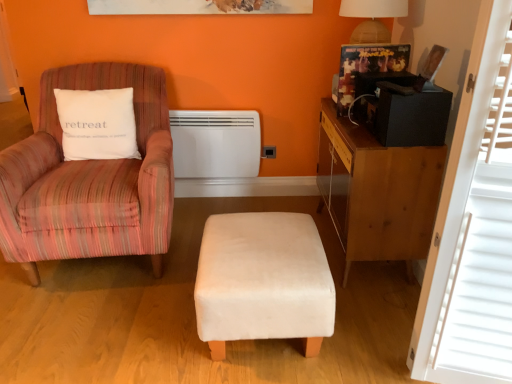
Describe the element at coordinates (215, 143) in the screenshot. I see `white matte heater at center` at that location.

Describe the element at coordinates (89, 179) in the screenshot. The width and height of the screenshot is (512, 384). I see `pink striped fabric chair at left` at that location.

The height and width of the screenshot is (384, 512). What do you see at coordinates (263, 281) in the screenshot? I see `velvet white stool at center` at bounding box center [263, 281].

This screenshot has height=384, width=512. I want to click on white matte heater at center, so click(215, 143).

From a real-world perspective, is white wood window screen at right located higher than white matte heater at center?

Correct, in the physical world, white wood window screen at right is higher than white matte heater at center.

Is white wood window screen at right aimed at white matte heater at center?

No, white wood window screen at right does not turn towards white matte heater at center.

Between point (509, 86) and point (179, 130), which one is positioned in front?

The point (509, 86) is closer.

From a real-world perspective, relative to white wood window screen at right, is pink striped fabric chair at left vertically above or below?

pink striped fabric chair at left is below white wood window screen at right.

From the image's perspective, which is above, pink striped fabric chair at left or white wood window screen at right?

pink striped fabric chair at left appears higher in the image.

Locate an element on the screen. The image size is (512, 384). chair on the left of white wood window screen at right is located at coordinates (89, 179).

Is pink striped fabric chair at left in front of or behind white wood window screen at right in the image?

pink striped fabric chair at left is positioned farther from the viewer than white wood window screen at right.

Looking at this image, considering the relative sizes of white wood window screen at right and wooden desk at right in the image provided, is white wood window screen at right smaller than wooden desk at right?

Indeed, white wood window screen at right has a smaller size compared to wooden desk at right.

Visually, is white wood window screen at right positioned to the left or to the right of wooden desk at right?

In the image, white wood window screen at right appears on the right side of wooden desk at right.

Looking at this image, from a real-world perspective, is white wood window screen at right physically located above or below wooden desk at right?

From a real-world perspective, white wood window screen at right is physically above wooden desk at right.

Measure the distance between white wood window screen at right and wooden desk at right.

white wood window screen at right and wooden desk at right are 22.74 inches apart from each other.

Which object is positioned more to the left, white matte heater at center or wooden desk at right?

white matte heater at center is more to the left.

What's the angular difference between white matte heater at center and wooden desk at right's facing directions?

white matte heater at center and wooden desk at right are facing 89.6 degrees away from each other.

Consider the image. Can you confirm if white matte heater at center is wider than wooden desk at right?

Incorrect, the width of white matte heater at center does not surpass that of wooden desk at right.

This screenshot has width=512, height=384. I want to click on heater that appears on the left of wooden desk at right, so click(x=215, y=143).

Is the surface of white velvety pillow at left in direct contact with wooden desk at right?

No, white velvety pillow at left is not next to wooden desk at right.

Is point (84, 135) more distant than point (384, 147)?

That is True.

Can wooden desk at right be found inside white velvety pillow at left?

No, wooden desk at right is not a part of white velvety pillow at left.

Identify the location of pillow behind the wooden desk at right. This screenshot has width=512, height=384. (97, 124).

Is pink striped fabric chair at left taller or shorter than velvet white stool at center?

Clearly, pink striped fabric chair at left is taller compared to velvet white stool at center.

From the picture: Can you confirm if pink striped fabric chair at left is wider than velvet white stool at center?

Indeed, pink striped fabric chair at left has a greater width compared to velvet white stool at center.

Does pink striped fabric chair at left lie in front of velvet white stool at center?

No, pink striped fabric chair at left is behind velvet white stool at center.

Are pink striped fabric chair at left and velvet white stool at center far apart?

No, pink striped fabric chair at left is in close proximity to velvet white stool at center.

Looking at this image, can you confirm if white matte heater at center is smaller than white velvety pillow at left?

Yes, white matte heater at center is smaller than white velvety pillow at left.

Is white matte heater at center positioned beyond the bounds of white velvety pillow at left?

Answer: Yes.

Is point (204, 147) closer to viewer compared to point (73, 127)?

No, it is not.

How many degrees apart are the facing directions of white matte heater at center and white velvety pillow at left?

4.64 degrees separate the facing orientations of white matte heater at center and white velvety pillow at left.

What are the coordinates of `heater that is above the white wood window screen at right (from the image's perspective)` in the screenshot? It's located at (215, 143).

Where is `window screen below the pink striped fabric chair at left (from the image's perspective)`? The height and width of the screenshot is (384, 512). window screen below the pink striped fabric chair at left (from the image's perspective) is located at coordinates (473, 227).

When comparing their distances from wooden desk at right, does white velvety pillow at left or white wood window screen at right seem further?

The object further to wooden desk at right is white velvety pillow at left.

When comparing their distances from wooden desk at right, does white velvety pillow at left or velvet white stool at center seem further?

white velvety pillow at left is positioned further to the anchor wooden desk at right.

Which object lies nearer to the anchor point white velvety pillow at left, velvet white stool at center or wooden desk at right?

The object closer to white velvety pillow at left is velvet white stool at center.

When comparing their distances from white matte heater at center, does white velvety pillow at left or wooden desk at right seem closer?

white velvety pillow at left.

When comparing their distances from white matte heater at center, does wooden desk at right or velvet white stool at center seem closer?

wooden desk at right is positioned closer to the anchor white matte heater at center.

Considering their positions, is white velvety pillow at left positioned further to pink striped fabric chair at left than white wood window screen at right?

Based on the image, white wood window screen at right appears to be further to pink striped fabric chair at left.

When comparing their distances from velvet white stool at center, does white velvety pillow at left or white matte heater at center seem closer?

white velvety pillow at left.

When comparing their distances from pink striped fabric chair at left, does white wood window screen at right or wooden desk at right seem further?

white wood window screen at right is further to pink striped fabric chair at left.

At what (x,y) coordinates should I click in order to perform the action: click on stool between white velvety pillow at left and white wood window screen at right. Please return your answer as a coordinate pair (x, y). The height and width of the screenshot is (384, 512). Looking at the image, I should click on [x=263, y=281].

What are the coordinates of `desk between pink striped fabric chair at left and white wood window screen at right` in the screenshot? It's located at (377, 191).

Identify the location of desk located between white velvety pillow at left and white wood window screen at right in the left-right direction. (377, 191).

Locate an element on the screen. This screenshot has width=512, height=384. stool between white wood window screen at right and wooden desk at right from front to back is located at coordinates (263, 281).